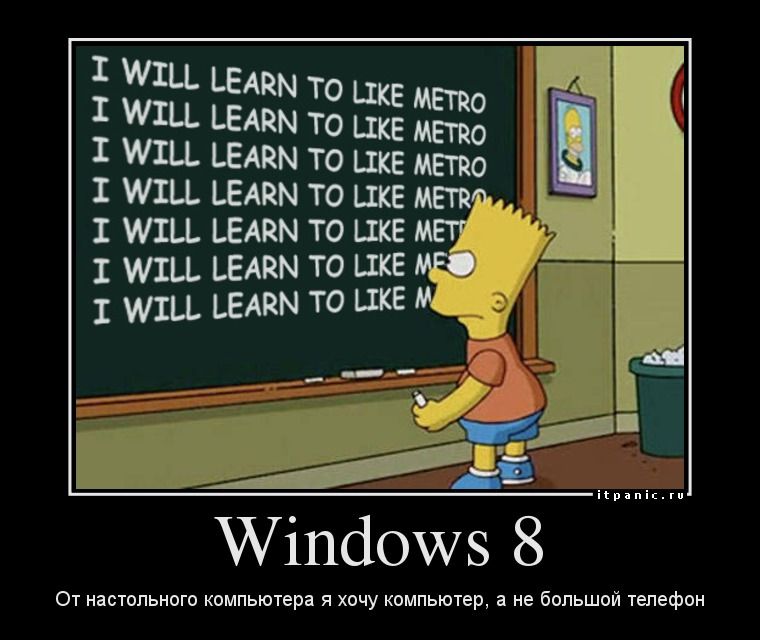
Locate an element on the screen. The width and height of the screenshot is (760, 640). photo on wall is located at coordinates (584, 127).